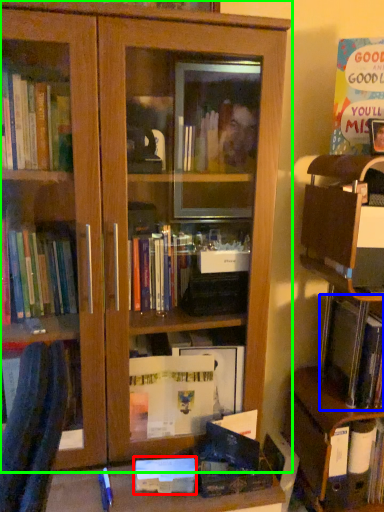
Question: Estimate the real-world distances between objects in this image. Which object is farther from paperback book (highlighted by a red box), book (highlighted by a blue box) or bookcase (highlighted by a green box)?

Choices:
 (A) book
 (B) bookcase

Answer: (B)